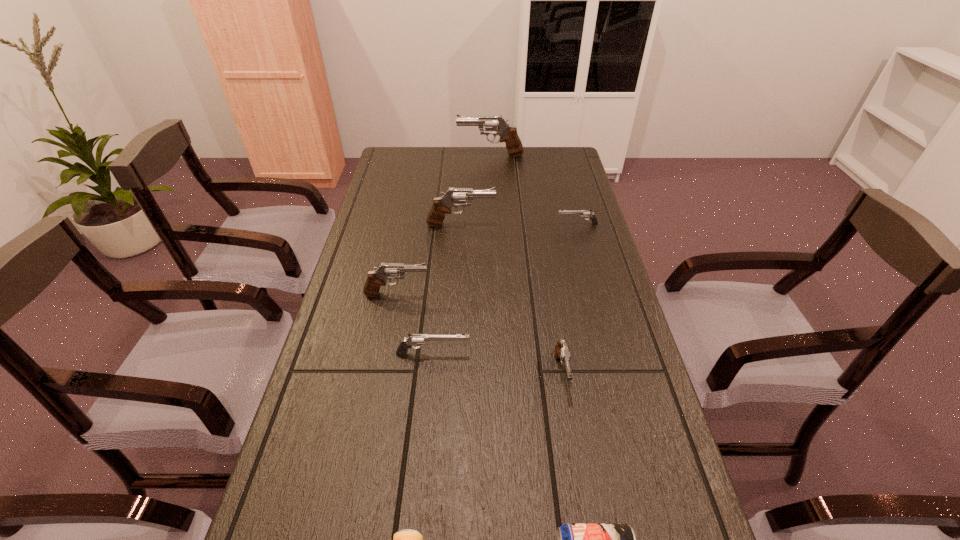
Identify the location of the smaller silver pistol. (584, 213).

Identify the location of the shortest pistol. This screenshot has height=540, width=960. (584, 213).

You are a GUI agent. You are given a task and a screenshot of the screen. Output one action in this format:
    pyautogui.click(x=<x>, y=<y>)
    Task: Click on the free space located 0.170m at the barrel of the tallest object
    This screenshot has height=540, width=960.
    Given the screenshot: What is the action you would take?
    pyautogui.click(x=416, y=156)

At what (x,y) coordinates should I click in order to perform the action: click on vacant space located 0.090m at the barrel of the tallest object. Please return your answer as a coordinate pair (x, y). This screenshot has width=960, height=540. Looking at the image, I should click on [435, 156].

Identify the location of vacant space located 0.130m at the barrel of the tallest object. (425, 156).

Locate an element on the screen. Image resolution: width=960 pixels, height=540 pixels. free location located 0.130m at the barrel of the second farthest gray pistol is located at coordinates (535, 225).

At what (x,y) coordinates should I click in order to perform the action: click on free space located 0.310m at the barrel of the fourth farthest pistol. Please return your answer as a coordinate pair (x, y). The height and width of the screenshot is (540, 960). Looking at the image, I should click on pyautogui.click(x=541, y=294).

The image size is (960, 540). I want to click on vacant point located 0.230m at the barrel of the smallest gray pistol, so click(583, 508).

Locate an element on the screen. This screenshot has width=960, height=540. vacant space located 0.260m on the front-facing side of the fifth tallest object is located at coordinates (577, 354).

Where is `vacant space positioned 0.110m on the front-facing side of the smaller silver pistol`? The height and width of the screenshot is (540, 960). vacant space positioned 0.110m on the front-facing side of the smaller silver pistol is located at coordinates (524, 224).